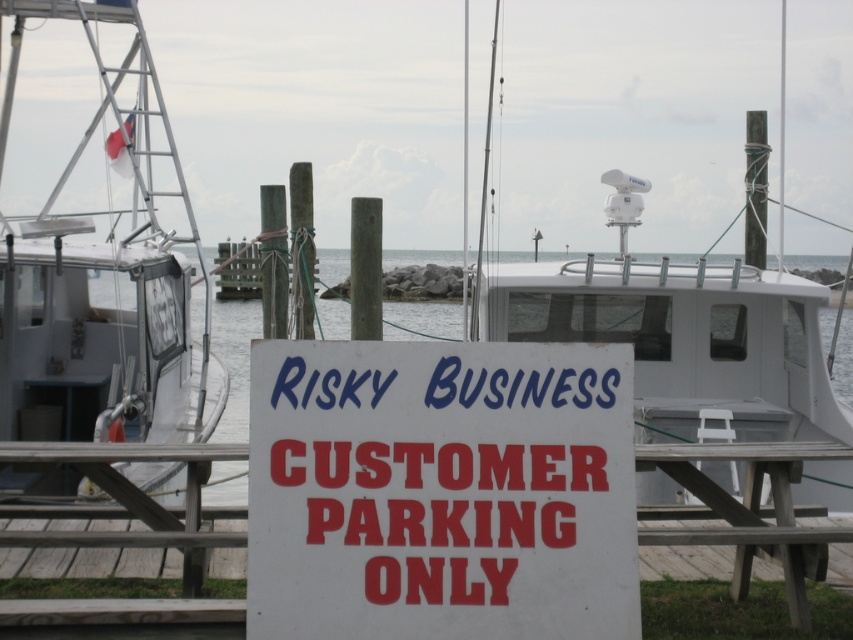
Between transparent water at center and wooden picnic table at center, which one has less height?

wooden picnic table at center

The height and width of the screenshot is (640, 853). I want to click on transparent water at center, so pyautogui.click(x=692, y=344).

The image size is (853, 640). In order to click on transparent water at center in this screenshot , I will do (x=692, y=344).

Which is more to the right, white glossy boat at left or transparent water at center?

From the viewer's perspective, transparent water at center appears more on the right side.

How distant is white glossy boat at left from transparent water at center?

white glossy boat at left is 7.83 meters from transparent water at center.

Is point (48, 276) closer to viewer compared to point (415, 321)?

Yes, point (48, 276) is in front of point (415, 321).

Locate an element on the screen. white glossy boat at left is located at coordinates (103, 278).

Is the position of white glossy boat at left less distant than that of white wooden dock at center?

No.

Looking at this image, who is taller, white glossy boat at left or white wooden dock at center?

white glossy boat at left

What are the coordinates of `white glossy boat at left` in the screenshot? It's located at (103, 278).